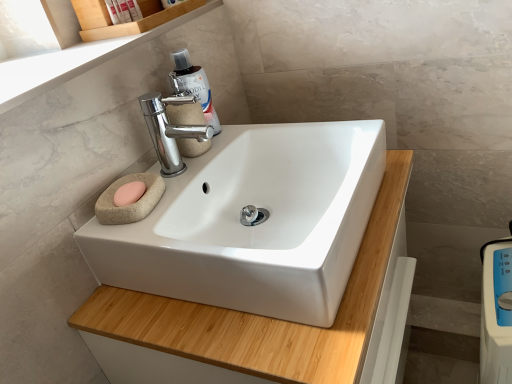
Image resolution: width=512 pixels, height=384 pixels. I want to click on matte plastic soap at upper left, which is the 1th toiletry in left-to-right order, so click(x=124, y=11).

Locate an element on the screen. The width and height of the screenshot is (512, 384). white glossy sink at center is located at coordinates (265, 317).

What do you see at coordinates (193, 85) in the screenshot? This screenshot has width=512, height=384. I see `translucent plastic bottle at upper center` at bounding box center [193, 85].

Image resolution: width=512 pixels, height=384 pixels. Describe the element at coordinates (129, 193) in the screenshot. I see `pink matte soap at left` at that location.

Measure the distance between point (486, 300) and camera.

34.25 inches.

What do you see at coordinates (496, 312) in the screenshot? The image size is (512, 384). I see `white plastic scale at lower right` at bounding box center [496, 312].

At what (x,y) coordinates should I click in order to perform the action: click on polished chrome faucet at upper center. Please return your answer as a coordinate pair (x, y). The height and width of the screenshot is (384, 512). Looking at the image, I should click on (170, 130).

Measure the distance between point (138, 7) and camera.

They are 3.37 feet apart.

Describe the element at coordinates (134, 10) in the screenshot. I see `white plastic bottle at upper left, acting as the 2th toiletry starting from the left` at that location.

Find the location of `matte plastic soap at upper left, the second toiletry when ordered from right to left`. matte plastic soap at upper left, the second toiletry when ordered from right to left is located at coordinates (124, 11).

From a real-world perspective, who is located lower, white glossy sink at center or translucent plastic bottle at upper center?

white glossy sink at center is physically lower.

Is white glossy sink at center with translucent plastic bottle at upper center?

white glossy sink at center and translucent plastic bottle at upper center are not in contact.

Which object is positioned more to the right, white glossy sink at center or translucent plastic bottle at upper center?

white glossy sink at center is more to the right.

Is point (372, 316) less distant than point (172, 57)?

Yes, point (372, 316) is closer to viewer.

Which object is further away from the camera taking this photo, translucent plastic bottle at upper center or white glossy sink at center?

translucent plastic bottle at upper center is behind.

Consider the image. Does translucent plastic bottle at upper center have a greater height compared to white glossy sink at center?

In fact, translucent plastic bottle at upper center may be shorter than white glossy sink at center.

Does translucent plastic bottle at upper center contain white glossy sink at center?

No, white glossy sink at center is not surrounded by translucent plastic bottle at upper center.

Locate an element on the screen. This screenshot has height=384, width=512. cleaning product above the white glossy sink at center (from the image's perspective) is located at coordinates pos(193,85).

Does white plastic bottle at upper left, acting as the 2th toiletry starting from the left, turn towards white plastic scale at lower right?

No.

How distant is white plastic bottle at upper left, acting as the 2th toiletry starting from the left, from white plastic scale at lower right?

white plastic bottle at upper left, acting as the 2th toiletry starting from the left, is 3.30 feet from white plastic scale at lower right.

Choose the correct answer: Is white plastic bottle at upper left, placed as the first toiletry when sorted from right to left, inside white plastic scale at lower right or outside it?

white plastic bottle at upper left, placed as the first toiletry when sorted from right to left, is outside white plastic scale at lower right.

Which is closer to the camera, (128, 2) or (510, 260)?

Positioned in front is point (510, 260).

Considering the relative positions of polished chrome faucet at upper center and white plastic bottle at upper left, placed as the first toiletry when sorted from right to left, in the image provided, is polished chrome faucet at upper center to the left of white plastic bottle at upper left, placed as the first toiletry when sorted from right to left, from the viewer's perspective?

In fact, polished chrome faucet at upper center is to the right of white plastic bottle at upper left, placed as the first toiletry when sorted from right to left.

Is polished chrome faucet at upper center facing towards white plastic bottle at upper left, acting as the 2th toiletry starting from the left?

No, polished chrome faucet at upper center is not aimed at white plastic bottle at upper left, acting as the 2th toiletry starting from the left.

In the scene shown: From their relative heights in the image, would you say polished chrome faucet at upper center is taller or shorter than white plastic bottle at upper left, placed as the first toiletry when sorted from right to left?

polished chrome faucet at upper center is taller than white plastic bottle at upper left, placed as the first toiletry when sorted from right to left.

Which of these two, white glossy sink at center or pink matte soap at left, is bigger?

Bigger between the two is white glossy sink at center.

In the scene shown: Between white glossy sink at center and pink matte soap at left, which one has smaller width?

pink matte soap at left.

Is white glossy sink at center oriented towards pink matte soap at left?

No.

Is white glossy sink at center completely or partially inside matte plastic soap at upper left, which is the 1th toiletry in left-to-right order?

No.

Based on the photo, is white glossy sink at center at the back of matte plastic soap at upper left, the second toiletry when ordered from right to left?

matte plastic soap at upper left, the second toiletry when ordered from right to left, does not have its back to white glossy sink at center.

Are matte plastic soap at upper left, the second toiletry when ordered from right to left, and white glossy sink at center far apart?

matte plastic soap at upper left, the second toiletry when ordered from right to left, is near white glossy sink at center, not far away.

Which is behind, matte plastic soap at upper left, which is the 1th toiletry in left-to-right order, or white glossy sink at center?

matte plastic soap at upper left, which is the 1th toiletry in left-to-right order.

Is matte plastic soap at upper left, the second toiletry when ordered from right to left, wider than polished chrome faucet at upper center?

No, matte plastic soap at upper left, the second toiletry when ordered from right to left, is not wider than polished chrome faucet at upper center.

From the image's perspective, is matte plastic soap at upper left, which is the 1th toiletry in left-to-right order, located beneath polished chrome faucet at upper center?

Incorrect, from the image's perspective, matte plastic soap at upper left, which is the 1th toiletry in left-to-right order, is higher than polished chrome faucet at upper center.

Looking at this image, which object is positioned more to the left, matte plastic soap at upper left, which is the 1th toiletry in left-to-right order, or polished chrome faucet at upper center?

matte plastic soap at upper left, which is the 1th toiletry in left-to-right order, is more to the left.

Is matte plastic soap at upper left, which is the 1th toiletry in left-to-right order, oriented away from polished chrome faucet at upper center?

That's not correct — matte plastic soap at upper left, which is the 1th toiletry in left-to-right order, is not looking away from polished chrome faucet at upper center.

At what (x,y) coordinates should I click in order to perform the action: click on bathroom cabinet located below the translucent plastic bottle at upper center (from the image's perspective). Please return your answer as a coordinate pair (x, y). The height and width of the screenshot is (384, 512). Looking at the image, I should click on (265, 317).

I want to click on cleaning product lying on the left of white glossy sink at center, so click(x=193, y=85).

Looking at the image, which one is located further to matte plastic soap at upper left, the second toiletry when ordered from right to left, polished chrome faucet at upper center or pink matte soap at left?

pink matte soap at left is positioned further to the anchor matte plastic soap at upper left, the second toiletry when ordered from right to left.

When comparing their distances from white plastic bottle at upper left, placed as the first toiletry when sorted from right to left, does matte plastic soap at upper left, which is the 1th toiletry in left-to-right order, or translucent plastic bottle at upper center seem closer?

matte plastic soap at upper left, which is the 1th toiletry in left-to-right order, lies closer to white plastic bottle at upper left, placed as the first toiletry when sorted from right to left, than the other object.

When comparing their distances from translucent plastic bottle at upper center, does white plastic scale at lower right or pink matte soap at left seem closer?

Among the two, pink matte soap at left is located nearer to translucent plastic bottle at upper center.

Looking at the image, which one is located further to white plastic bottle at upper left, acting as the 2th toiletry starting from the left, polished chrome faucet at upper center or pink matte soap at left?

pink matte soap at left is further to white plastic bottle at upper left, acting as the 2th toiletry starting from the left.

When comparing their distances from matte plastic soap at upper left, the second toiletry when ordered from right to left, does translucent plastic bottle at upper center or white glossy sink at center seem further?

The object further to matte plastic soap at upper left, the second toiletry when ordered from right to left, is white glossy sink at center.

From the image, which object appears to be farther from matte plastic soap at upper left, which is the 1th toiletry in left-to-right order, white plastic bottle at upper left, acting as the 2th toiletry starting from the left, or white plastic scale at lower right?

Based on the image, white plastic scale at lower right appears to be further to matte plastic soap at upper left, which is the 1th toiletry in left-to-right order.

Based on their spatial positions, is polished chrome faucet at upper center or translucent plastic bottle at upper center closer to white glossy sink at center?

polished chrome faucet at upper center is positioned closer to the anchor white glossy sink at center.

Estimate the real-world distances between objects in this image. Which object is closer to white plastic scale at lower right, translucent plastic bottle at upper center or white glossy sink at center?

white glossy sink at center is closer to white plastic scale at lower right.

This screenshot has width=512, height=384. What are the coordinates of `cleaning product between white plastic bottle at upper left, placed as the first toiletry when sorted from right to left, and pink matte soap at left in the up-down direction` in the screenshot? It's located at (193, 85).

Locate an element on the screen. The width and height of the screenshot is (512, 384). cleaning product between pink matte soap at left and white plastic scale at lower right is located at coordinates (193, 85).

Where is `bathroom cabinet between white plastic bottle at upper left, acting as the 2th toiletry starting from the left, and white plastic scale at lower right vertically`? The image size is (512, 384). bathroom cabinet between white plastic bottle at upper left, acting as the 2th toiletry starting from the left, and white plastic scale at lower right vertically is located at coordinates (265, 317).

Find the location of a particular element. The height and width of the screenshot is (384, 512). toiletry between matte plastic soap at upper left, the second toiletry when ordered from right to left, and white plastic scale at lower right, in the horizontal direction is located at coordinates (134, 10).